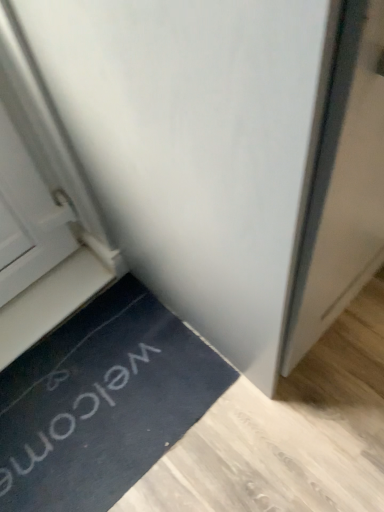
Describe the element at coordinates (183, 163) in the screenshot. This screenshot has height=512, width=384. I see `white matte door at center` at that location.

Measure the distance between white plastic stairwell at lower left and camera.

The distance of white plastic stairwell at lower left from camera is 1.19 meters.

Find the location of a particular element. This screenshot has width=384, height=512. black rubber doormat at lower left is located at coordinates (101, 402).

Is white plastic stairwell at lower left in contact with black rubber doormat at lower left?

No, white plastic stairwell at lower left is not next to black rubber doormat at lower left.

Which is more to the right, white plastic stairwell at lower left or black rubber doormat at lower left?

black rubber doormat at lower left is more to the right.

Considering the points (112, 264) and (13, 380), which point is behind, point (112, 264) or point (13, 380)?

The point (112, 264) is farther from the camera.

Considering the sizes of white matte door at center and black rubber doormat at lower left in the image, is white matte door at center wider or thinner than black rubber doormat at lower left?

In the image, white matte door at center appears to be wider than black rubber doormat at lower left.

Do you think white matte door at center is within black rubber doormat at lower left, or outside of it?

white matte door at center is located beyond the bounds of black rubber doormat at lower left.

From the picture: Considering the positions of objects white matte door at center and black rubber doormat at lower left in the image provided, who is more to the right, white matte door at center or black rubber doormat at lower left?

From the viewer's perspective, white matte door at center appears more on the right side.

From a real-world perspective, relative to black rubber doormat at lower left, is white matte door at center vertically above or below?

From a real-world perspective, white matte door at center is physically above black rubber doormat at lower left.

Who is more distant, black rubber doormat at lower left or white matte door at center?

black rubber doormat at lower left is further away from the camera.

From the image's perspective, relative to white matte door at center, is black rubber doormat at lower left above or below?

black rubber doormat at lower left is situated lower than white matte door at center in the image.

Can you tell me how much black rubber doormat at lower left and white matte door at center differ in facing direction?

The angle between the facing direction of black rubber doormat at lower left and the facing direction of white matte door at center is 0.897 degrees.

Between black rubber doormat at lower left and white matte door at center, which one has smaller size?

black rubber doormat at lower left is smaller.

From the image's perspective, which one is positioned lower, white matte door at center or white plastic stairwell at lower left?

white plastic stairwell at lower left.

Locate an element on the screen. Image resolution: width=384 pixels, height=512 pixels. stairwell behind the white matte door at center is located at coordinates (54, 298).

Would you say white matte door at center is outside white plastic stairwell at lower left?

white matte door at center lies outside white plastic stairwell at lower left's area.

Are white matte door at center and white plastic stairwell at lower left making contact?

No, white matte door at center is not touching white plastic stairwell at lower left.

Is black rubber doormat at lower left smaller than white plastic stairwell at lower left?

No.

Is black rubber doormat at lower left in contact with white plastic stairwell at lower left?

black rubber doormat at lower left is not next to white plastic stairwell at lower left, and they're not touching.

Which point is more distant from viewer, [80,451] or [54,290]?

Point [54,290]

Could white matte door at center be considered to be inside white plastic stairwell at lower left?

No, white matte door at center is not surrounded by white plastic stairwell at lower left.

Would you say white plastic stairwell at lower left is to the left or to the right of white matte door at center in the picture?

Based on their positions, white plastic stairwell at lower left is located to the left of white matte door at center.

Locate an element on the screen. This screenshot has height=512, width=384. stairwell lying on the left of white matte door at center is located at coordinates (54, 298).

Is white plastic stairwell at lower left turned away from white matte door at center?

No, white plastic stairwell at lower left is not facing the opposite direction of white matte door at center.

The image size is (384, 512). In order to click on stairwell behind the black rubber doormat at lower left in this screenshot , I will do `click(54, 298)`.

Locate an element on the screen. The height and width of the screenshot is (512, 384). door located above the black rubber doormat at lower left (from the image's perspective) is located at coordinates (183, 163).

Considering their positions, is black rubber doormat at lower left positioned closer to white plastic stairwell at lower left than white matte door at center?

black rubber doormat at lower left.

Looking at the image, which one is located closer to black rubber doormat at lower left, white plastic stairwell at lower left or white matte door at center?

Based on the image, white plastic stairwell at lower left appears to be nearer to black rubber doormat at lower left.

From the image, which object appears to be nearer to black rubber doormat at lower left, white matte door at center or white plastic stairwell at lower left?

white plastic stairwell at lower left is positioned closer to the anchor black rubber doormat at lower left.

Considering their positions, is white matte door at center positioned further to white plastic stairwell at lower left than black rubber doormat at lower left?

Based on the image, white matte door at center appears to be further to white plastic stairwell at lower left.

Considering their positions, is white plastic stairwell at lower left positioned further to white matte door at center than black rubber doormat at lower left?

The object further to white matte door at center is black rubber doormat at lower left.

When comparing their distances from white matte door at center, does black rubber doormat at lower left or white plastic stairwell at lower left seem further?

black rubber doormat at lower left.

At what (x,y) coordinates should I click in order to perform the action: click on doormat located between white matte door at center and white plastic stairwell at lower left in the depth direction. Please return your answer as a coordinate pair (x, y). Image resolution: width=384 pixels, height=512 pixels. Looking at the image, I should click on (101, 402).